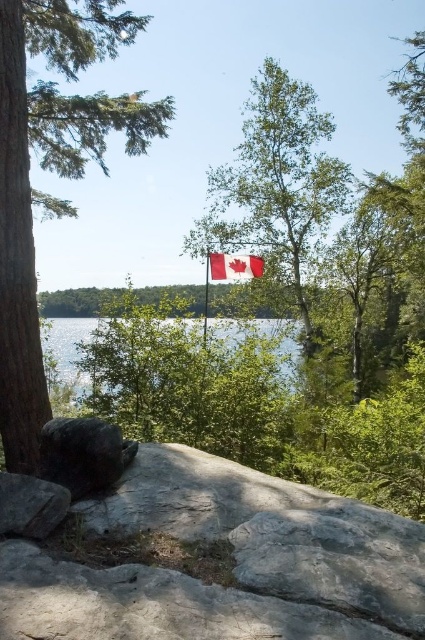
Does transparent water at center have a smaller size compared to red fabric flag at center?

Indeed, transparent water at center has a smaller size compared to red fabric flag at center.

Between point (263, 321) and point (223, 278), which one is positioned behind?

The point (263, 321) is more distant.

Identify the location of transparent water at center. The height and width of the screenshot is (640, 425). (68, 356).

Between dark gray rock at lower left and red fabric flag at center, which one has more height?

red fabric flag at center

Who is positioned more to the right, dark gray rock at lower left or red fabric flag at center?

From the viewer's perspective, red fabric flag at center appears more on the right side.

Is point (45, 456) in front of point (231, 264)?

Yes.

Identify the location of dark gray rock at lower left. The width and height of the screenshot is (425, 640). point(82,454).

Can you confirm if rough gray rock at lower left is wider than red fabric flag at center?

No.

The image size is (425, 640). I want to click on rough gray rock at lower left, so [31, 506].